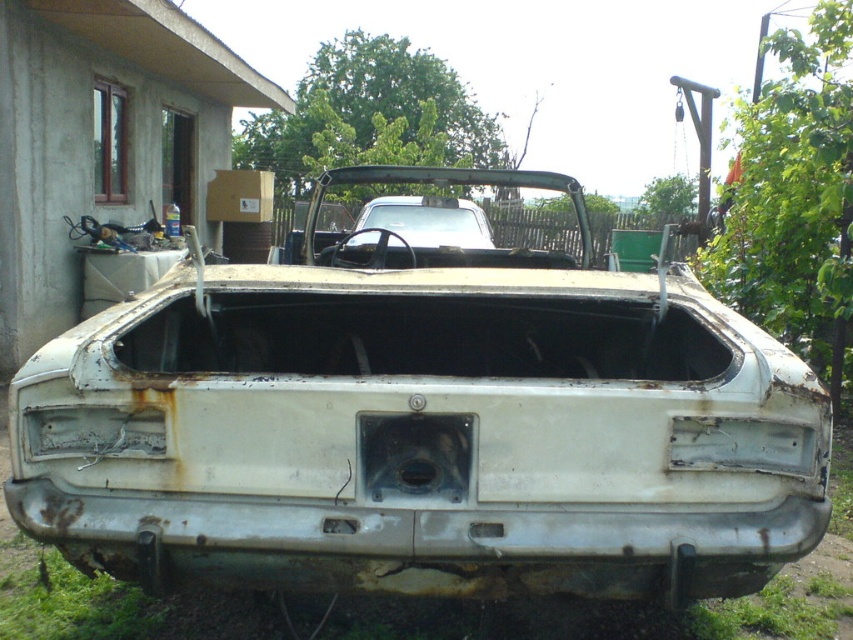
You are a mechanic working in a garage. You have two cars in front of you, the rusty metal car at center and the white matte car at center. From your position in the garage, which car is positioned to the right?

The rusty metal car at center is to the right of the white matte car at center, so the rusty metal car at center is positioned to the right.

You are standing in a backyard workshop and see the rusty metal car at center. Where is the rusty metal car located in terms of coordinates?

The rusty metal car at center is located at coordinates point (422, 422).